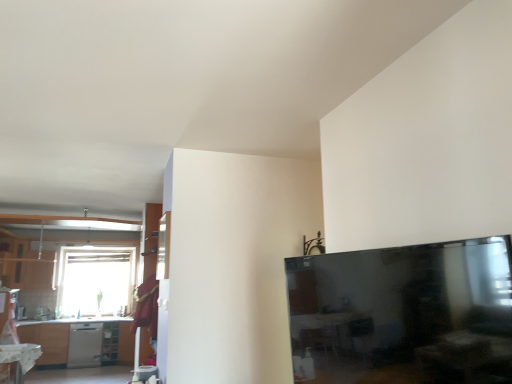
Question: Can you confirm if white glossy table at lower left is smaller than matte white shelf at lower left?

Choices:
 (A) yes
 (B) no

Answer: (B)

Question: Is white glossy table at lower left positioned before matte white shelf at lower left?

Choices:
 (A) yes
 (B) no

Answer: (A)

Question: Is white glossy table at lower left shorter than matte white shelf at lower left?

Choices:
 (A) yes
 (B) no

Answer: (A)

Question: Is matte white shelf at lower left located within white glossy table at lower left?

Choices:
 (A) yes
 (B) no

Answer: (B)

Question: Is white glossy table at lower left far from matte white shelf at lower left?

Choices:
 (A) yes
 (B) no

Answer: (A)

Question: From the image's perspective, is white glossy table at lower left located beneath matte white shelf at lower left?

Choices:
 (A) no
 (B) yes

Answer: (A)

Question: Is matte wood cabinet at left inside matte white shelf at lower left?

Choices:
 (A) no
 (B) yes

Answer: (A)

Question: Is matte white shelf at lower left not inside matte wood cabinet at left?

Choices:
 (A) yes
 (B) no

Answer: (A)

Question: From a real-world perspective, is matte white shelf at lower left beneath matte wood cabinet at left?

Choices:
 (A) yes
 (B) no

Answer: (A)

Question: Is matte white shelf at lower left facing away from matte wood cabinet at left?

Choices:
 (A) yes
 (B) no

Answer: (B)

Question: From the image's perspective, would you say matte white shelf at lower left is positioned over matte wood cabinet at left?

Choices:
 (A) no
 (B) yes

Answer: (A)

Question: Is matte white shelf at lower left at the right side of matte wood cabinet at left?

Choices:
 (A) yes
 (B) no

Answer: (A)

Question: Is satin silver dishwasher at lower left next to white glossy table at lower left?

Choices:
 (A) yes
 (B) no

Answer: (B)